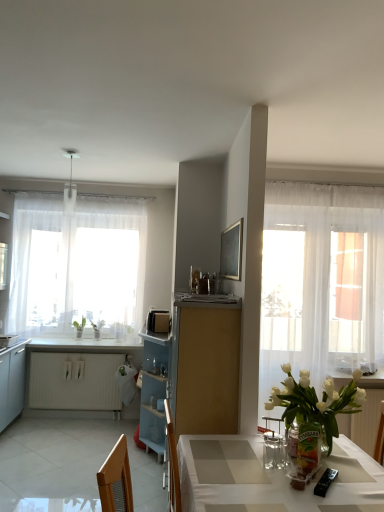
Where is `matte wood cabinet at center, which is the 1th cabinetry from right to left`? This screenshot has height=512, width=384. matte wood cabinet at center, which is the 1th cabinetry from right to left is located at coordinates (205, 366).

Measure the distance between point (x=365, y=504) and camera.

Point (x=365, y=504) is 1.63 meters from camera.

Identify the location of green leafy plant at lower left. This screenshot has height=512, width=384. (97, 328).

What do you see at coordinates (158, 321) in the screenshot? The height and width of the screenshot is (512, 384). I see `satin black microwave at center, which is counted as the second appliance, starting from the left` at bounding box center [158, 321].

Find the location of a particular element. The image size is (384, 512). sheer white curtain at right is located at coordinates (321, 280).

From a real-world perspective, which object stands above the other?

From a 3D spatial view, satin black microwave at center, which is the 2th appliance in right-to-left order, is above.

Choose the correct answer: Is white fabric table at lower right inside satin black microwave at center, which is counted as the second appliance, starting from the left, or outside it?

white fabric table at lower right is outside satin black microwave at center, which is counted as the second appliance, starting from the left.

Can you confirm if white fabric table at lower right is taller than satin black microwave at center, which appears as the first appliance when viewed from the back?

Correct, white fabric table at lower right is much taller as satin black microwave at center, which appears as the first appliance when viewed from the back.

Consider the image. Does white fabric table at lower right have a lesser width compared to satin black microwave at center, which is counted as the second appliance, starting from the left?

No, white fabric table at lower right is not thinner than satin black microwave at center, which is counted as the second appliance, starting from the left.

Is transparent glass vase at center-right inside the boundaries of matte wood cabinet at center, placed as the third cabinetry when sorted from left to right, or outside?

transparent glass vase at center-right is located beyond the bounds of matte wood cabinet at center, placed as the third cabinetry when sorted from left to right.

Does transparent glass vase at center-right touch matte wood cabinet at center, acting as the third cabinetry starting from the back?

No, transparent glass vase at center-right is not in contact with matte wood cabinet at center, acting as the third cabinetry starting from the back.

Is point (309, 471) in front of point (229, 422)?

Yes, it is.

Is transparent glass vase at center-right facing towards matte wood cabinet at center, which ranks as the first cabinetry in front-to-back order?

No.

From a real-world perspective, which is physically above, transparent glass vase at center-right or black plastic remote control at lower right, the 3th appliance in the top-to-bottom sequence?

transparent glass vase at center-right.

Is transparent glass vase at center-right thinner than black plastic remote control at lower right, acting as the third appliance starting from the left?

Yes, transparent glass vase at center-right is thinner than black plastic remote control at lower right, acting as the third appliance starting from the left.

Considering the relative positions of transparent glass vase at center-right and black plastic remote control at lower right, the 3th appliance in the top-to-bottom sequence, in the image provided, is transparent glass vase at center-right to the right of black plastic remote control at lower right, the 3th appliance in the top-to-bottom sequence, from the viewer's perspective?

In fact, transparent glass vase at center-right is to the left of black plastic remote control at lower right, the 3th appliance in the top-to-bottom sequence.

Between transparent glass vase at center-right and black plastic remote control at lower right, acting as the third appliance starting from the left, which one has more height?

With more height is transparent glass vase at center-right.

Is white matte radiator at lower left, positioned as the third cabinetry in front-to-back order, aimed at satin black microwave at center, which appears as the first appliance when viewed from the back?

No, white matte radiator at lower left, positioned as the third cabinetry in front-to-back order, does not turn towards satin black microwave at center, which appears as the first appliance when viewed from the back.

Looking at this image, from a real-world perspective, does white matte radiator at lower left, positioned as the third cabinetry in front-to-back order, stand above satin black microwave at center, which is the 3th appliance from front to back?

No, from a real-world perspective, white matte radiator at lower left, positioned as the third cabinetry in front-to-back order, is not above satin black microwave at center, which is the 3th appliance from front to back.

Which of these two, white matte radiator at lower left, the 1th cabinetry when ordered from back to front, or satin black microwave at center, which is the 3th appliance from front to back, is thinner?

white matte radiator at lower left, the 1th cabinetry when ordered from back to front.

How many degrees apart are the facing directions of white matte radiator at lower left, positioned as the third cabinetry in front-to-back order, and satin black microwave at center, which is counted as the second appliance, starting from the left?

They differ by 86 degrees in their facing directions.

Which is in front, point (304, 467) or point (71, 398)?

The point (304, 467) is closer.

Is transparent glass vase at center-right touching white matte radiator at lower left, the 1th cabinetry when ordered from back to front?

No, transparent glass vase at center-right is not in contact with white matte radiator at lower left, the 1th cabinetry when ordered from back to front.

Is transparent glass vase at center-right shorter than white matte radiator at lower left, the 1th cabinetry when ordered from back to front?

Indeed, transparent glass vase at center-right has a lesser height compared to white matte radiator at lower left, the 1th cabinetry when ordered from back to front.

Can you confirm if black plastic remote control at lower right, acting as the third appliance starting from the left, is positioned to the left of white glossy microwave at left, the second appliance positioned from the front?

Incorrect, black plastic remote control at lower right, acting as the third appliance starting from the left, is not on the left side of white glossy microwave at left, the second appliance positioned from the front.

Can you tell me how much black plastic remote control at lower right, the 3th appliance in the top-to-bottom sequence, and white glossy microwave at left, placed as the 2th appliance when sorted from top to bottom, differ in facing direction?

57.7 degrees.

Who is bigger, black plastic remote control at lower right, the 3th appliance in the top-to-bottom sequence, or white glossy microwave at left, marked as the 2th appliance in a bottom-to-top arrangement?

white glossy microwave at left, marked as the 2th appliance in a bottom-to-top arrangement, is bigger.

Is black plastic remote control at lower right, the third appliance in the back-to-front sequence, directly adjacent to white glossy microwave at left, marked as the 1th appliance in a left-to-right arrangement?

black plastic remote control at lower right, the third appliance in the back-to-front sequence, and white glossy microwave at left, marked as the 1th appliance in a left-to-right arrangement, are not in contact.

Does white sheer curtain at left have a smaller size compared to transparent glass vase at center-right?

Actually, white sheer curtain at left might be larger than transparent glass vase at center-right.

At what (x,y) coordinates should I click in order to perform the action: click on glass vase to the right of white sheer curtain at left. Please return your answer as a coordinate pair (x, y). The width and height of the screenshot is (384, 512). Looking at the image, I should click on (308, 448).

Is white sheer curtain at left spatially inside transparent glass vase at center-right, or outside of it?

white sheer curtain at left is spatially situated outside transparent glass vase at center-right.

From a real-world perspective, does white sheer curtain at left sit lower than transparent glass vase at center-right?

No.

The width and height of the screenshot is (384, 512). Identify the location of the 3rd appliance above when counting from the white fabric table at lower right (from the image's perspective). (158, 321).

Find the location of a particular element. This screenshot has width=384, height=512. the 1st cabinetry below when counting from the transparent glass vase at center-right (from the image's perspective) is located at coordinates (205, 366).

Which object lies nearer to the anchor point white matte radiator at lower left, the 1th cabinetry when ordered from back to front, white glossy counter top at lower left or black plastic remote control at lower right, the first appliance when ordered from right to left?

white glossy counter top at lower left.

Based on their spatial positions, is sheer white curtain at right or black plastic remote control at lower right, the first appliance when ordered from right to left, closer to white matte radiator at lower left, the first cabinetry in the left-to-right sequence?

The object closer to white matte radiator at lower left, the first cabinetry in the left-to-right sequence, is sheer white curtain at right.

Which object lies further to the anchor point sheer white curtain at right, white fabric table at lower right or white glossy microwave at left, acting as the 2th appliance starting from the back?

white glossy microwave at left, acting as the 2th appliance starting from the back, is further to sheer white curtain at right.

Which object lies nearer to the anchor point light blue plastic cabinet at center, the second cabinetry when ordered from front to back, white glossy microwave at left, marked as the 2th appliance in a bottom-to-top arrangement, or green leafy plant at lower left?

green leafy plant at lower left.

Looking at the image, which one is located further to satin black microwave at center, which is counted as the second appliance, starting from the left, white sheer curtain at left or matte wood cabinet at center, placed as the third cabinetry when sorted from left to right?

matte wood cabinet at center, placed as the third cabinetry when sorted from left to right.

Looking at the image, which one is located closer to satin black microwave at center, which is the 2th appliance in right-to-left order, white fabric table at lower right or transparent glass vase at center-right?

Based on the image, white fabric table at lower right appears to be nearer to satin black microwave at center, which is the 2th appliance in right-to-left order.

Considering their positions, is sheer white curtain at right positioned closer to white fabric table at lower right than green leafy plant at lower left?

The object closer to white fabric table at lower right is sheer white curtain at right.

Which object lies nearer to the anchor point transparent glass vase at center-right, black plastic remote control at lower right, the third appliance in the back-to-front sequence, or light blue plastic cabinet at center, the second cabinetry positioned from the left?

black plastic remote control at lower right, the third appliance in the back-to-front sequence.

Where is `window between transparent glass vase at center-right and green leafy plant at lower left in the front-back direction`? window between transparent glass vase at center-right and green leafy plant at lower left in the front-back direction is located at coordinates (77, 265).

The width and height of the screenshot is (384, 512). I want to click on appliance between white fabric table at lower right and light blue plastic cabinet at center, the second cabinetry positioned from the back, from front to back, so click(325, 482).

The height and width of the screenshot is (512, 384). Identify the location of appliance between white fabric table at lower right and white glossy microwave at left, the second appliance positioned from the front, in the front-back direction. (325, 482).

Identify the location of window between black plastic remote control at lower right, the 3th appliance in the top-to-bottom sequence, and green leafy plant at lower left in the front-back direction. The image size is (384, 512). (77, 265).